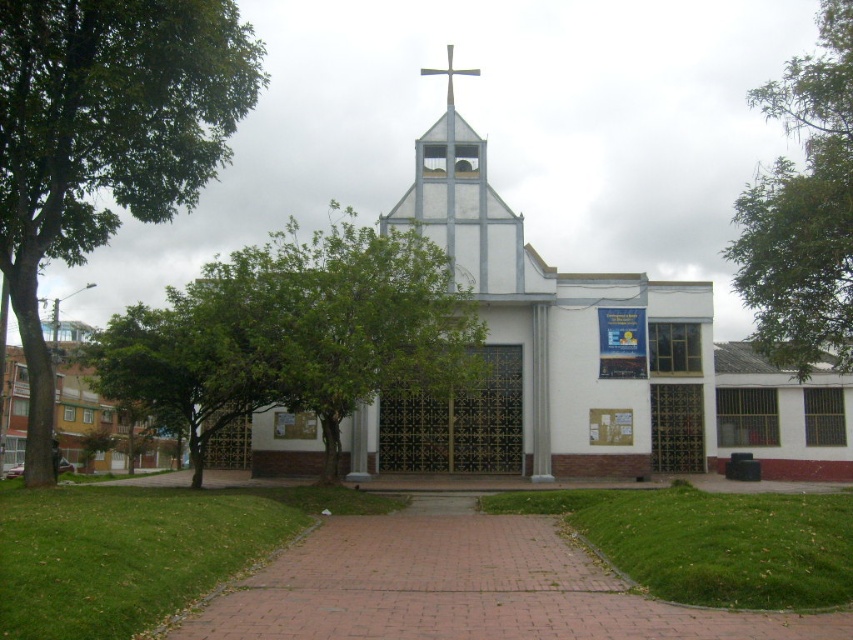
Question: Which object is closer to the camera taking this photo?

Choices:
 (A) green leafy tree at left
 (B) silver metallic cross at center

Answer: (A)

Question: Can you confirm if green leafy tree at left is thinner than green leafy tree at center?

Choices:
 (A) yes
 (B) no

Answer: (A)

Question: Estimate the real-world distances between objects in this image. Which object is closer to the green leafy tree at left?

Choices:
 (A) green leafy tree at center
 (B) brick pathway at center
 (C) green leafy tree at upper right

Answer: (A)

Question: Does green leafy tree at left have a greater width compared to green leafy tree at upper right?

Choices:
 (A) yes
 (B) no

Answer: (A)

Question: Can you confirm if green leafy tree at left is positioned to the left of silver metallic cross at center?

Choices:
 (A) no
 (B) yes

Answer: (B)

Question: Among these objects, which one is farthest from the camera?

Choices:
 (A) green leafy tree at left
 (B) brick pathway at center

Answer: (A)